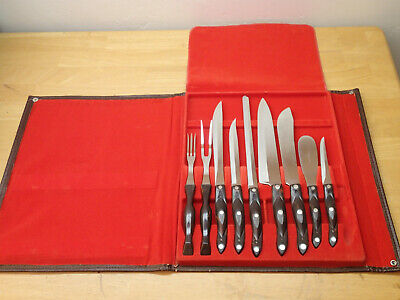
The image size is (400, 300). Identify the location of handle. (188, 224), (206, 218), (220, 214), (236, 215), (257, 218), (281, 215), (298, 211), (314, 210), (331, 210).